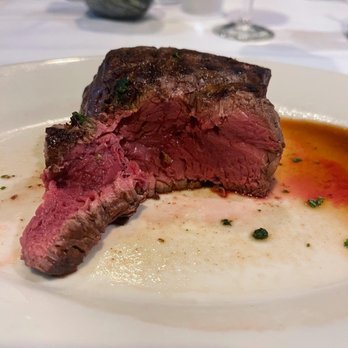
This screenshot has width=348, height=348. In order to click on tablecloth in this screenshot , I will do `click(16, 57)`.